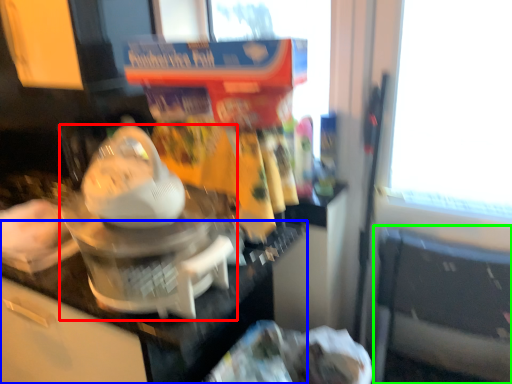
Question: Estimate the real-world distances between objects in this image. Which object is farther from kitchen appliance (highlighted by a red box), counter top (highlighted by a blue box) or chair (highlighted by a green box)?

Choices:
 (A) counter top
 (B) chair

Answer: (B)